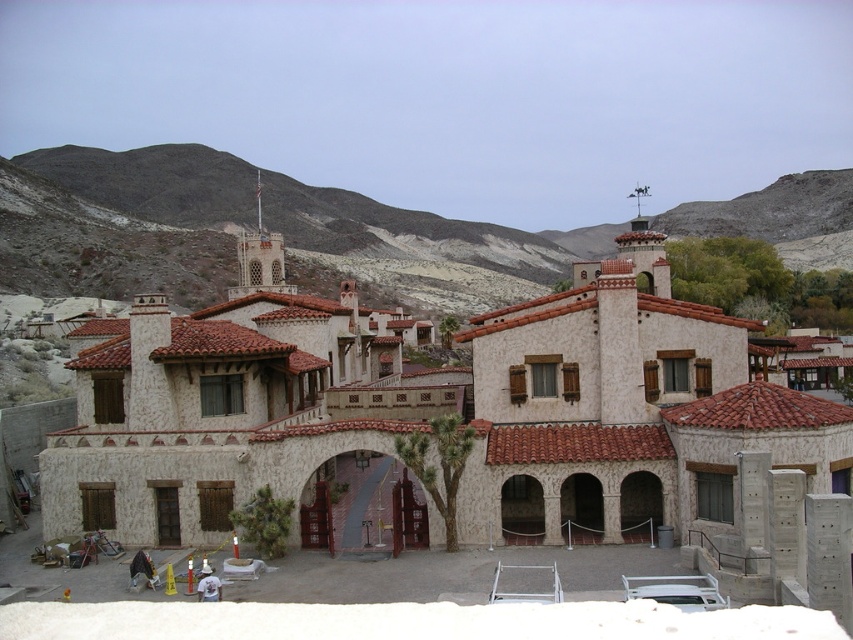
Question: Is white stucco building at center closer to the viewer compared to gray rocky mountain at upper center?

Choices:
 (A) yes
 (B) no

Answer: (A)

Question: Which point is closer to the camera taking this photo?

Choices:
 (A) (424, 221)
 (B) (837, 467)

Answer: (B)

Question: Which point appears farthest from the camera in this image?

Choices:
 (A) (735, 381)
 (B) (119, 285)

Answer: (B)

Question: Can you confirm if white stucco building at center is positioned to the right of gray rocky mountain at upper center?

Choices:
 (A) yes
 (B) no

Answer: (A)

Question: Does white stucco building at center appear under gray rocky mountain at upper center?

Choices:
 (A) yes
 (B) no

Answer: (A)

Question: Which point is farther from the camera taking this photo?

Choices:
 (A) (152, 337)
 (B) (38, 250)

Answer: (B)